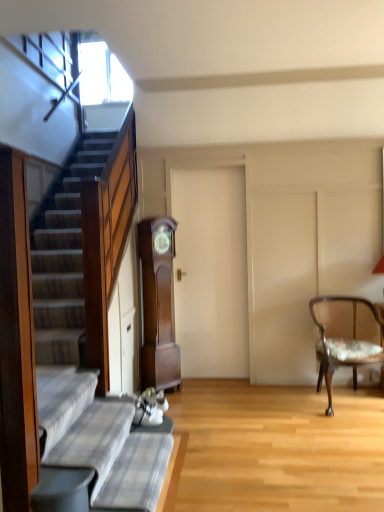
Question: From a real-world perspective, is plaid fabric couch at lower left located beneath wooden cane chair with floral cushion at right?

Choices:
 (A) no
 (B) yes

Answer: (B)

Question: Does plaid fabric couch at lower left appear on the right side of wooden cane chair with floral cushion at right?

Choices:
 (A) yes
 (B) no

Answer: (B)

Question: Considering the relative positions of plaid fabric couch at lower left and wooden cane chair with floral cushion at right in the image provided, is plaid fabric couch at lower left behind wooden cane chair with floral cushion at right?

Choices:
 (A) yes
 (B) no

Answer: (B)

Question: Does plaid fabric couch at lower left appear on the left side of wooden cane chair with floral cushion at right?

Choices:
 (A) no
 (B) yes

Answer: (B)

Question: Is plaid fabric couch at lower left shorter than wooden cane chair with floral cushion at right?

Choices:
 (A) yes
 (B) no

Answer: (A)

Question: Can you confirm if plaid fabric couch at lower left is bigger than wooden cane chair with floral cushion at right?

Choices:
 (A) yes
 (B) no

Answer: (B)

Question: Considering the relative sizes of plaid fabric couch at lower left and brown wood grandfather clock at center in the image provided, is plaid fabric couch at lower left taller than brown wood grandfather clock at center?

Choices:
 (A) yes
 (B) no

Answer: (B)

Question: Is plaid fabric couch at lower left closer to camera compared to brown wood grandfather clock at center?

Choices:
 (A) no
 (B) yes

Answer: (B)

Question: Can you confirm if plaid fabric couch at lower left is positioned to the left of brown wood grandfather clock at center?

Choices:
 (A) yes
 (B) no

Answer: (A)

Question: Is brown wood grandfather clock at center inside plaid fabric couch at lower left?

Choices:
 (A) no
 (B) yes

Answer: (A)

Question: From the image's perspective, would you say plaid fabric couch at lower left is positioned over brown wood grandfather clock at center?

Choices:
 (A) no
 (B) yes

Answer: (A)

Question: Does plaid fabric couch at lower left have a larger size compared to brown wood grandfather clock at center?

Choices:
 (A) yes
 (B) no

Answer: (B)

Question: Is wooden cane chair with floral cushion at right aimed at plaid fabric couch at lower left?

Choices:
 (A) yes
 (B) no

Answer: (B)